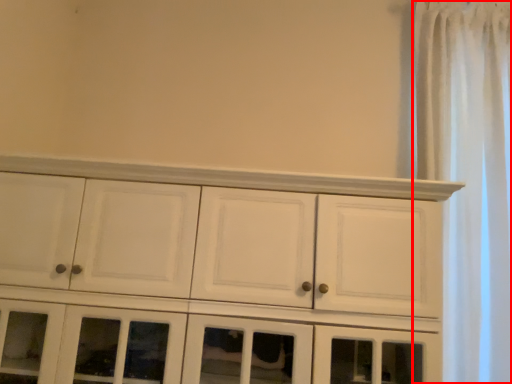
Question: From the image's perspective, where is shower curtain (annotated by the red box) located in relation to cupboard in the image?

Choices:
 (A) above
 (B) below

Answer: (A)